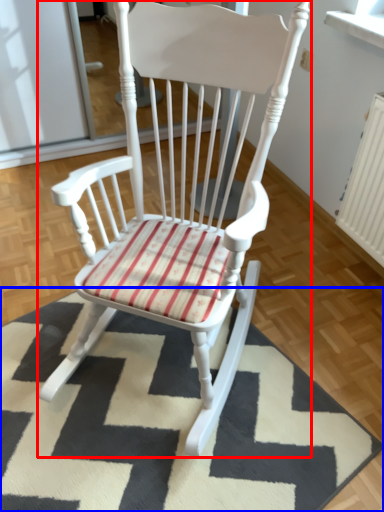
Question: Which object is further to the camera taking this photo, chair (highlighted by a red box) or mat (highlighted by a blue box)?

Choices:
 (A) chair
 (B) mat

Answer: (B)